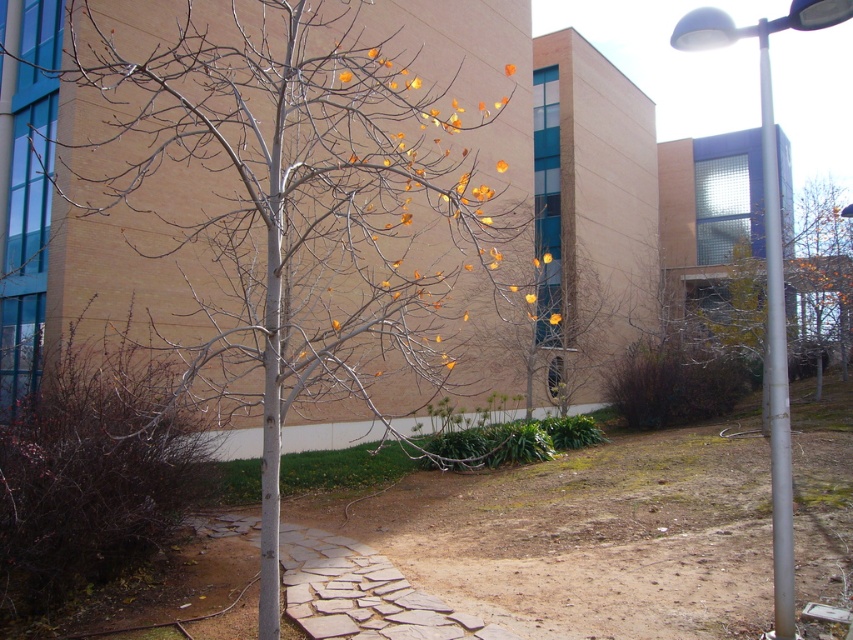
Based on the photo, is smooth gray tree at center wider than white metallic pole at right?

Incorrect, smooth gray tree at center's width does not surpass white metallic pole at right's.

Is point (496, 232) farther from viewer compared to point (784, 388)?

Yes, point (496, 232) is farther from viewer.

Image resolution: width=853 pixels, height=640 pixels. I want to click on smooth gray tree at center, so click(296, 209).

The width and height of the screenshot is (853, 640). In order to click on smooth gray tree at center in this screenshot , I will do `click(296, 209)`.